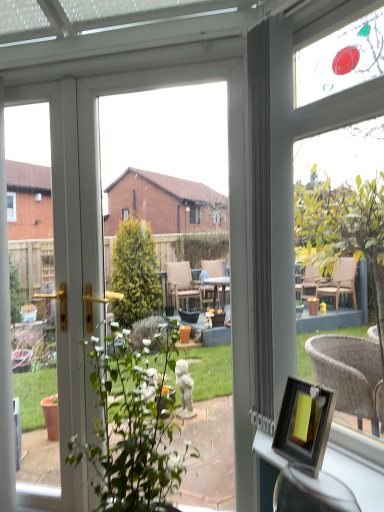
Question: Is point (127, 494) positioned closer to the camera than point (324, 109)?

Choices:
 (A) closer
 (B) farther

Answer: (B)

Question: In the image, is green leafy plant at center on the left side or the right side of matte wicker chair at upper right?

Choices:
 (A) right
 (B) left

Answer: (B)

Question: Considering the real-world distances, which object is farthest from the green leafy plant at center?

Choices:
 (A) wooden frame at lower right
 (B) matte wicker chair at upper right
 (C) wooden picture frame at lower right

Answer: (B)

Question: Estimate the real-world distances between objects in this image. Which object is farther from the green leafy plant at center?

Choices:
 (A) wooden picture frame at lower right
 (B) matte wicker chair at upper right
 (C) wooden frame at lower right

Answer: (B)